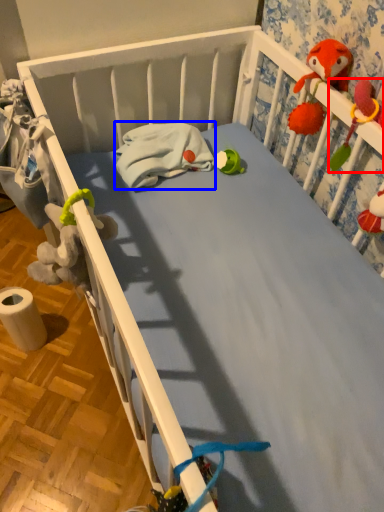
Question: Which object appears farthest to the camera in this image, toy (highlighted by a red box) or material (highlighted by a blue box)?

Choices:
 (A) toy
 (B) material

Answer: (B)